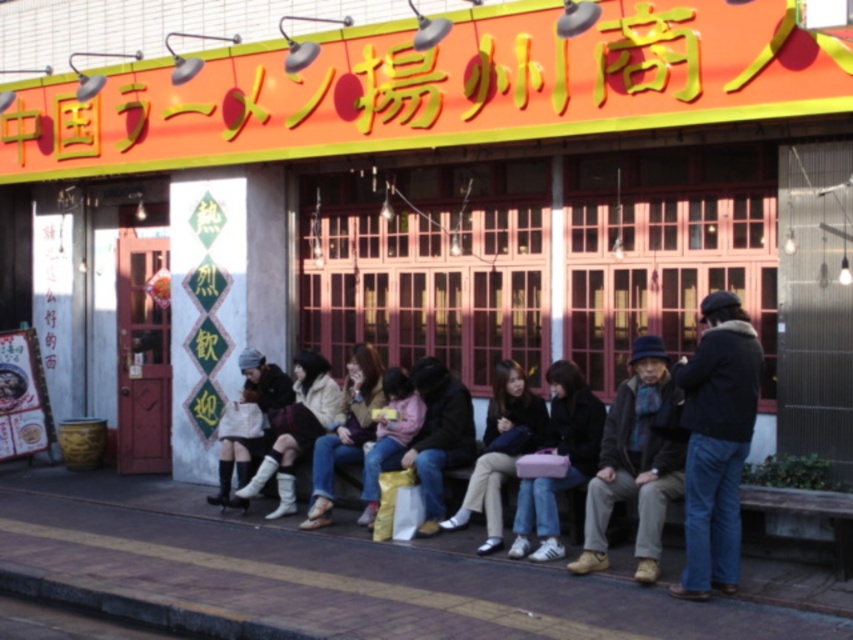
Question: Among these points, which one is farthest from the camera?

Choices:
 (A) (691, 358)
 (B) (421, 426)

Answer: (B)

Question: Is pink fabric bag at center closer to camera compared to light brown leather jacket at center?

Choices:
 (A) yes
 (B) no

Answer: (A)

Question: Which of these objects is positioned closest to the denim jacket at center?

Choices:
 (A) matte pink sweater at center
 (B) dark gray woolen hat at center
 (C) light brown leather jacket at center

Answer: (A)

Question: Observing the image, what is the correct spatial positioning of black fuzzy jacket at right in reference to denim jacket at center?

Choices:
 (A) left
 (B) right

Answer: (B)

Question: Which object is positioned farthest from the dark blue jeans at center?

Choices:
 (A) dark gray woolen hat at center
 (B) dark gray jacket at center
 (C) black fuzzy jacket at right

Answer: (C)

Question: Is light brown leather jacket at center bigger than matte pink sweater at center?

Choices:
 (A) no
 (B) yes

Answer: (B)